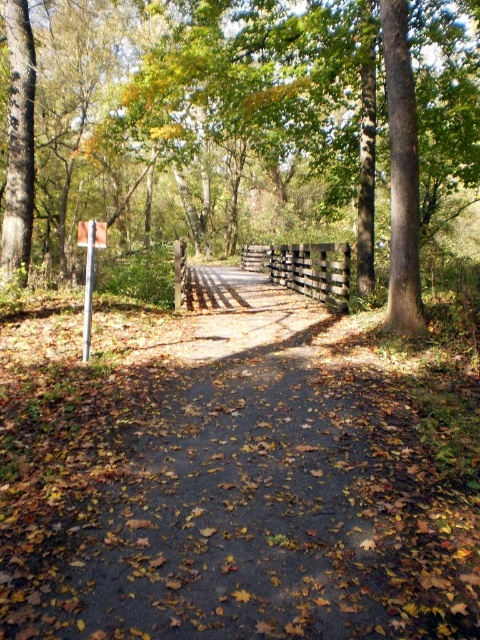
Measure the distance between brown wood fence at center and camera.

brown wood fence at center and camera are 7.13 meters apart.

Between point (38, 22) and point (277, 257), which one is positioned behind?

Positioned behind is point (38, 22).

Is point (407, 4) in front of point (288, 262)?

Yes, it is in front of point (288, 262).

Where is `brown wood fence at center`? The image size is (480, 640). brown wood fence at center is located at coordinates (240, 128).